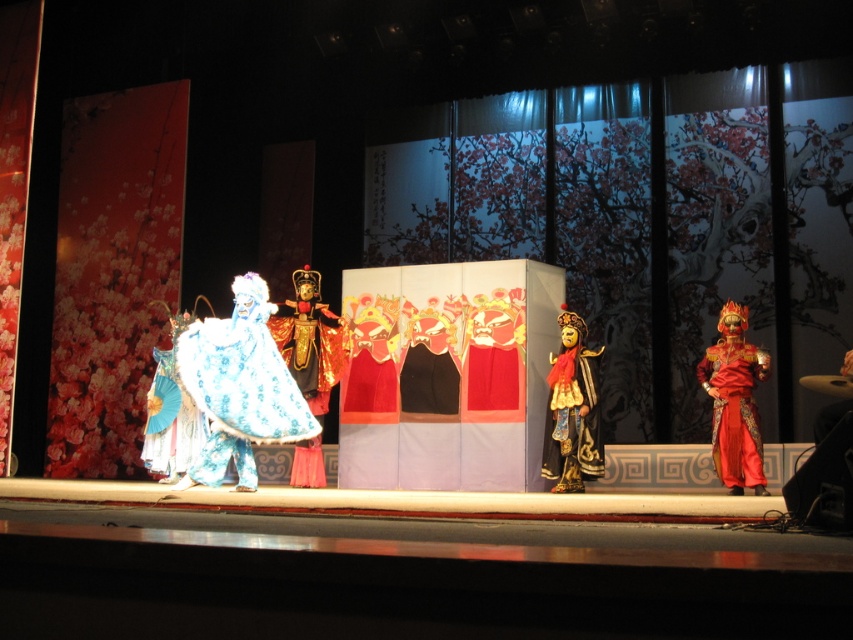
You are an audience member sitting in the front row of the theater. You notice the gold textured mask at center and the shiny blue fabric at center on stage. Which object is located to the right of the other?

The gold textured mask at center is positioned on the right side of shiny blue fabric at center.

You are an audience member sitting in the front row of the theater. You notice two items at the center of the stage. One is the gold textured mask at center and the other is the shiny blue fabric at center. Which of these two items is larger?

The shiny blue fabric at center is larger than the gold textured mask at center.

You are a stagehand preparing to adjust the lighting for the performance. You need to position a spotlight so it illuminates both the shiny red costume at right and the gold textured mask at center without moving the existing stage props. Based on their positions, which object should you aim the spotlight at first to ensure both are lit?

The shiny red costume at right is located below the gold textured mask at center. To illuminate both, aim the spotlight at the gold textured mask at center first, as it is higher up, and the light will naturally cascade down to the shiny red costume at right below it.